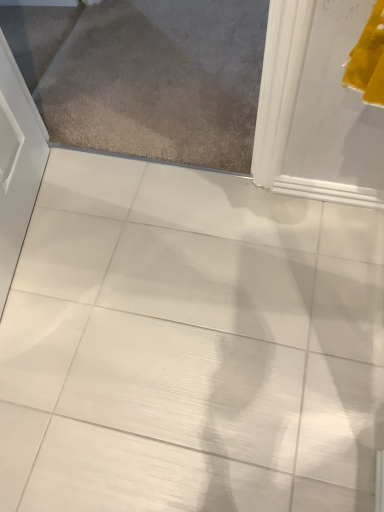
The width and height of the screenshot is (384, 512). Describe the element at coordinates (146, 76) in the screenshot. I see `matte gray carpet at upper left` at that location.

This screenshot has width=384, height=512. Identify the location of matte gray carpet at upper left. (146, 76).

Image resolution: width=384 pixels, height=512 pixels. What do you see at coordinates (190, 346) in the screenshot?
I see `white glossy tile at center` at bounding box center [190, 346].

What is the approximate width of white glossy tile at center?

The width of white glossy tile at center is 1.08 meters.

This screenshot has width=384, height=512. In order to click on white glossy tile at center in this screenshot , I will do `click(190, 346)`.

This screenshot has height=512, width=384. I want to click on matte gray carpet at upper left, so pos(146,76).

In the scene shown: Is white glossy tile at center at the left side of matte gray carpet at upper left?

Indeed, white glossy tile at center is positioned on the left side of matte gray carpet at upper left.

Between white glossy tile at center and matte gray carpet at upper left, which one is positioned in front?

white glossy tile at center is more forward.

Considering the positions of point (107, 249) and point (237, 16), is point (107, 249) closer or farther from the camera than point (237, 16)?

Clearly, point (107, 249) is closer to the camera than point (237, 16).

From the image's perspective, is white glossy tile at center located beneath matte gray carpet at upper left?

Yes.

From a real-world perspective, between white glossy tile at center and matte gray carpet at upper left, who is vertically higher?

matte gray carpet at upper left.

Can you confirm if white glossy tile at center is thinner than matte gray carpet at upper left?

Yes.

Consider the image. Considering the sizes of objects white glossy tile at center and matte gray carpet at upper left in the image provided, who is taller, white glossy tile at center or matte gray carpet at upper left?

matte gray carpet at upper left is taller.

Considering the sizes of objects white glossy tile at center and matte gray carpet at upper left in the image provided, who is bigger, white glossy tile at center or matte gray carpet at upper left?

white glossy tile at center is bigger.

Is matte gray carpet at upper left a part of white glossy tile at center?

No, matte gray carpet at upper left is not inside white glossy tile at center.

Are white glossy tile at center and matte gray carpet at upper left far apart?

No, white glossy tile at center is in close proximity to matte gray carpet at upper left.

Is white glossy tile at center facing towards matte gray carpet at upper left?

Yes, white glossy tile at center faces towards matte gray carpet at upper left.

The height and width of the screenshot is (512, 384). What are the coordinates of `ceramic tile in front of the matte gray carpet at upper left` in the screenshot? It's located at pyautogui.click(x=190, y=346).

Looking at this image, considering the positions of objects matte gray carpet at upper left and white glossy tile at center in the image provided, who is more to the left, matte gray carpet at upper left or white glossy tile at center?

From the viewer's perspective, white glossy tile at center appears more on the left side.

Which object is more forward, matte gray carpet at upper left or white glossy tile at center?

white glossy tile at center.

Does point (213, 94) come in front of point (85, 390)?

No, (213, 94) is behind (85, 390).

From the image's perspective, which is above, matte gray carpet at upper left or white glossy tile at center?

From the image's view, matte gray carpet at upper left is above.

From a real-world perspective, which is physically below, matte gray carpet at upper left or white glossy tile at center?

white glossy tile at center, from a real-world perspective.

Considering the sizes of matte gray carpet at upper left and white glossy tile at center in the image, is matte gray carpet at upper left wider or thinner than white glossy tile at center?

matte gray carpet at upper left is wider than white glossy tile at center.

From their relative heights in the image, would you say matte gray carpet at upper left is taller or shorter than white glossy tile at center?

Clearly, matte gray carpet at upper left is shorter compared to white glossy tile at center.

Consider the image. Who is bigger, matte gray carpet at upper left or white glossy tile at center?

white glossy tile at center.

In the scene shown: Would you say white glossy tile at center is part of matte gray carpet at upper left's contents?

That's incorrect, white glossy tile at center is not inside matte gray carpet at upper left.

Is matte gray carpet at upper left in contact with white glossy tile at center?

matte gray carpet at upper left and white glossy tile at center are clearly separated.

Is matte gray carpet at upper left oriented towards white glossy tile at center?

No, matte gray carpet at upper left is not aimed at white glossy tile at center.

What's the angular difference between matte gray carpet at upper left and white glossy tile at center's facing directions?

The facing directions of matte gray carpet at upper left and white glossy tile at center are 2.14e-05 degrees apart.

Identify the location of ceramic tile on the left of matte gray carpet at upper left. The width and height of the screenshot is (384, 512). (190, 346).

You are a GUI agent. You are given a task and a screenshot of the screen. Output one action in this format:
    pyautogui.click(x=<x>, y=<y>)
    Task: Click on the ceramic tile below the matte gray carpet at upper left (from a real-world perspective)
    Image resolution: width=384 pixels, height=512 pixels.
    Given the screenshot: What is the action you would take?
    pyautogui.click(x=190, y=346)

You are a GUI agent. You are given a task and a screenshot of the screen. Output one action in this format:
    pyautogui.click(x=<x>, y=<y>)
    Task: Click on the glass door above the white glossy tile at center (from the image's perspective)
    The image size is (384, 512).
    Given the screenshot: What is the action you would take?
    (146, 76)